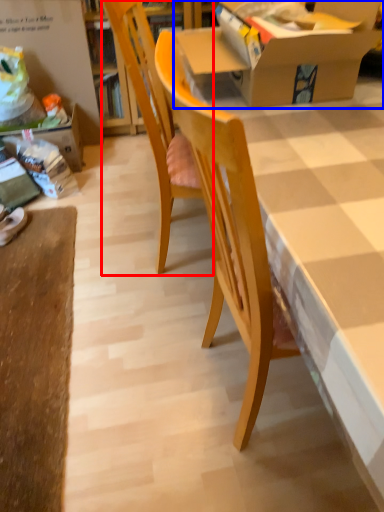
Question: Among these objects, which one is nearest to the camera, chair (highlighted by a red box) or box (highlighted by a blue box)?

Choices:
 (A) chair
 (B) box

Answer: (B)